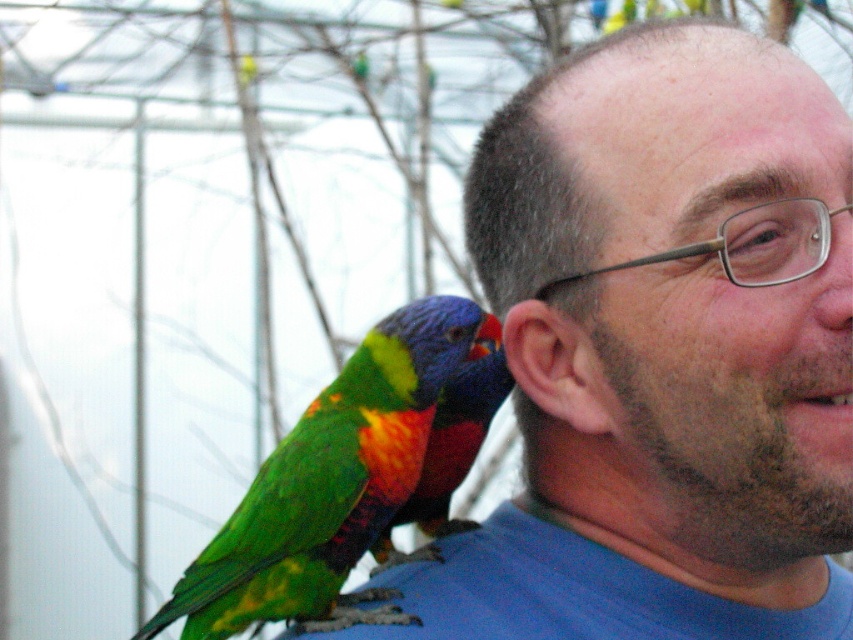
Question: Does multicolored feathered parrot at upper left appear on the right side of smooth skin head at center?

Choices:
 (A) no
 (B) yes

Answer: (A)

Question: Which point is farther to the camera?

Choices:
 (A) (593, 307)
 (B) (325, 424)

Answer: (B)

Question: Is multicolored feathered parrot at upper left to the right of smooth skin head at center from the viewer's perspective?

Choices:
 (A) no
 (B) yes

Answer: (A)

Question: Does multicolored feathered parrot at upper left come in front of smooth skin head at center?

Choices:
 (A) yes
 (B) no

Answer: (B)